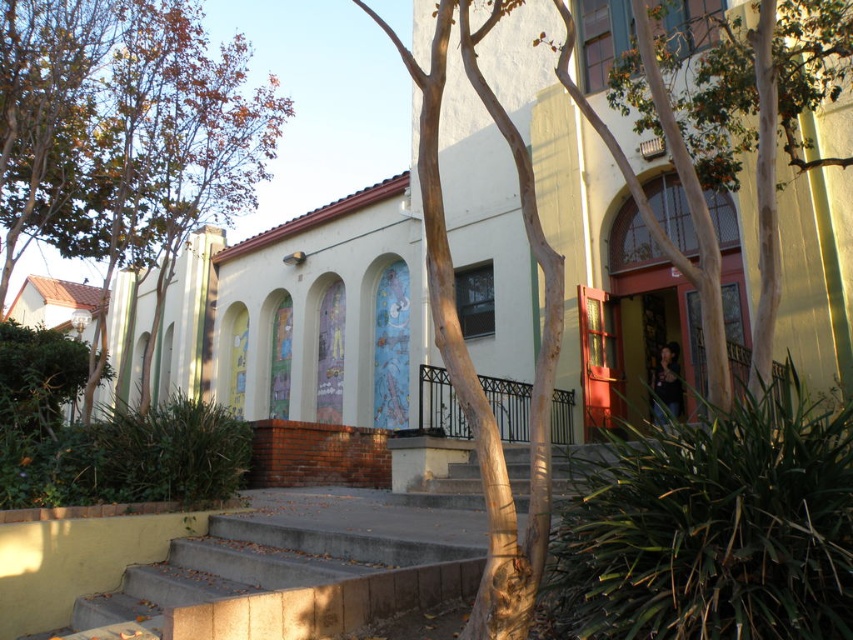
Question: Where is brown leafy tree at upper left located in relation to concrete/steps at lower center in the image?

Choices:
 (A) left
 (B) right

Answer: (A)

Question: In this image, where is brown leafy tree at upper left located relative to concrete/steps at lower center?

Choices:
 (A) left
 (B) right

Answer: (A)

Question: Which point is farther to the camera?

Choices:
 (A) concrete/steps at lower center
 (B) brown leafy tree at upper left

Answer: (B)

Question: Which object appears farthest from the camera in this image?

Choices:
 (A) brown leafy tree at upper left
 (B) concrete/steps at lower center

Answer: (A)

Question: Does brown leafy tree at upper left have a greater width compared to concrete/steps at lower center?

Choices:
 (A) no
 (B) yes

Answer: (A)